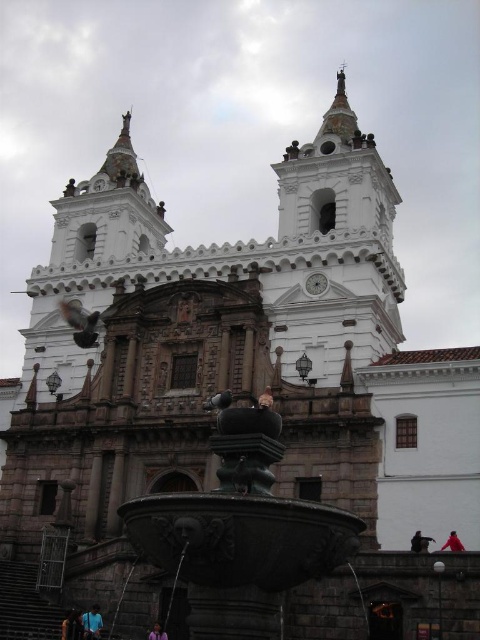
You are standing in front of the historic church and want to take a photo. You notice two points marked in the scene. Which point, point (85, 630) or point (312, 285), is closer to you?

Point (85, 630) is closer to the camera than point (312, 285).

Based on the photo, you are a tourist visiting the historic church and notice the white glossy clock at upper center and the matte gray pigeon at center. Which object appears smaller in the image?

The white glossy clock at upper center appears smaller than the matte gray pigeon at center.